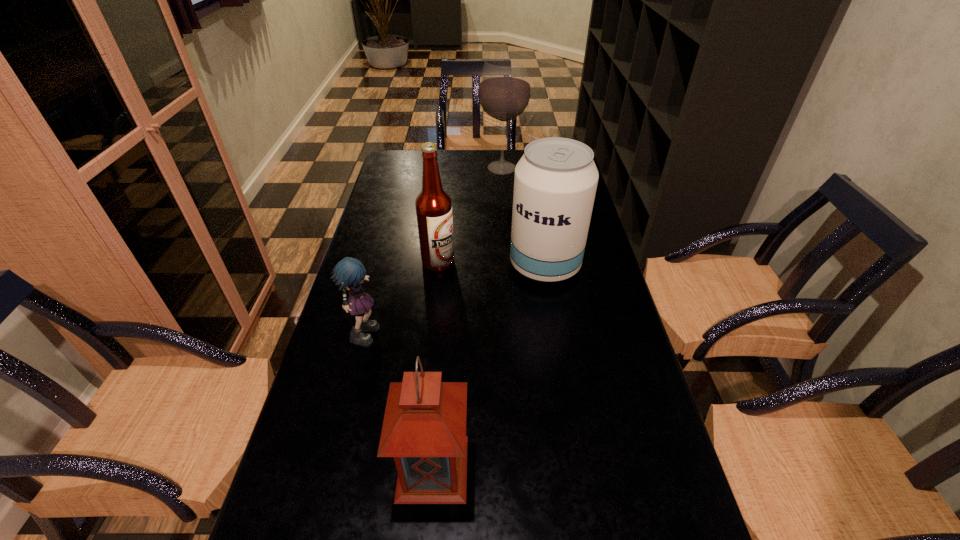
Image resolution: width=960 pixels, height=540 pixels. Find the location of `object that is the second closest to the nearest object`. object that is the second closest to the nearest object is located at coordinates (555, 182).

Select which object is the third closest to the farthest object. Please provide its 2D coordinates. Your answer should be formatted as a tuple, i.e. [(x, y)], where the tuple contains the x and y coordinates of a point satisfying the conditions above.

[(349, 273)]

In order to click on alcohol object that ranks as the second closest to the rag doll in this screenshot , I will do `click(555, 182)`.

Point out which alcohol is positioned as the third nearest to the leftmost object. Please provide its 2D coordinates. Your answer should be formatted as a tuple, i.e. [(x, y)], where the tuple contains the x and y coordinates of a point satisfying the conditions above.

[(504, 91)]

The width and height of the screenshot is (960, 540). Find the location of `blank area in the image that satisfies the following two spatial constraints: 1. on the label side of the nearest object; 2. on the right side of the leftmost alcohol`. blank area in the image that satisfies the following two spatial constraints: 1. on the label side of the nearest object; 2. on the right side of the leftmost alcohol is located at coordinates (416, 468).

At what (x,y) coordinates should I click in order to perform the action: click on vacant area in the image that satisfies the following two spatial constraints: 1. on the front-facing side of the leftmost object; 2. on the left side of the lantern. Please return your answer as a coordinate pair (x, y). This screenshot has width=960, height=540. Looking at the image, I should click on (331, 468).

Find the location of `vacant space that satisfies the following two spatial constraints: 1. on the label side of the leftmost alcohol; 2. on the left side of the lantern`. vacant space that satisfies the following two spatial constraints: 1. on the label side of the leftmost alcohol; 2. on the left side of the lantern is located at coordinates (416, 468).

Locate an element on the screen. The width and height of the screenshot is (960, 540). vacant area that satisfies the following two spatial constraints: 1. on the label side of the leftmost alcohol; 2. on the right side of the lantern is located at coordinates (416, 468).

Find the location of a particular element. The image size is (960, 540). vacant space that satisfies the following two spatial constraints: 1. on the front-facing side of the shortest object; 2. on the back side of the nearest object is located at coordinates (331, 468).